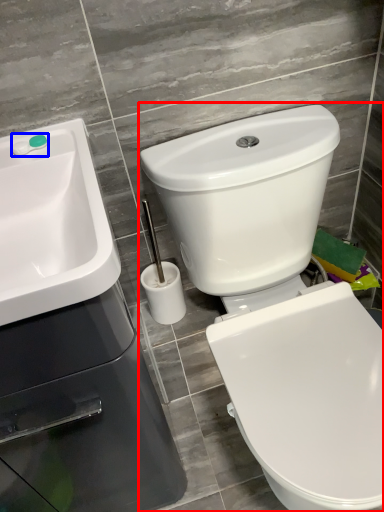
Question: Which object is further to the camera taking this photo, toilet (highlighted by a red box) or plumbing fixture (highlighted by a blue box)?

Choices:
 (A) toilet
 (B) plumbing fixture

Answer: (B)